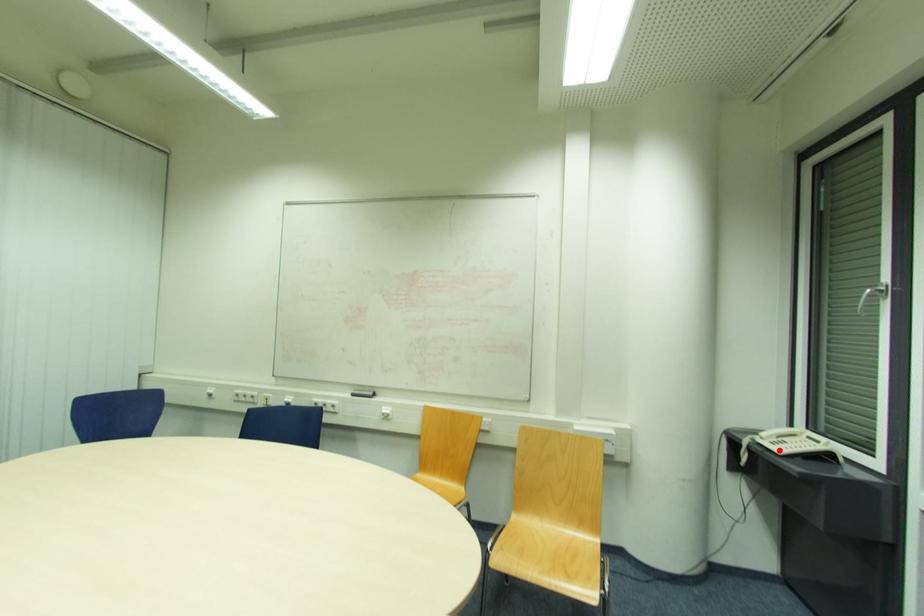
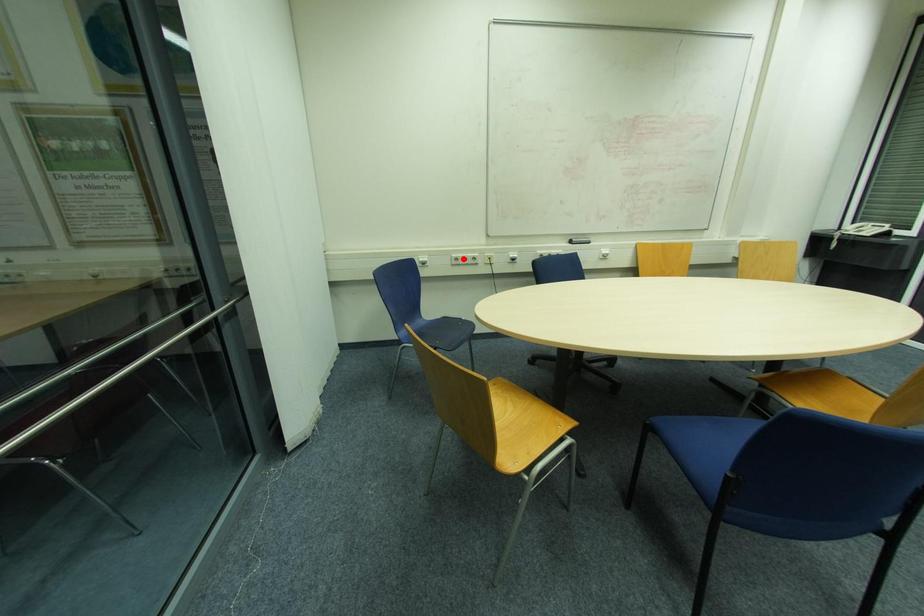
I am providing you with two images of the same scene from different viewpoints. A red point is marked on the first image and another point is marked on the second image. Is the red point in image1 aligned with the point shown in image2?

No